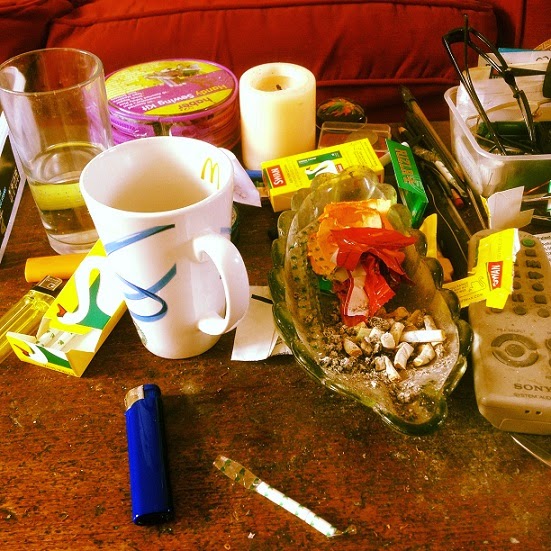
Identify the location of couch. (228, 39).